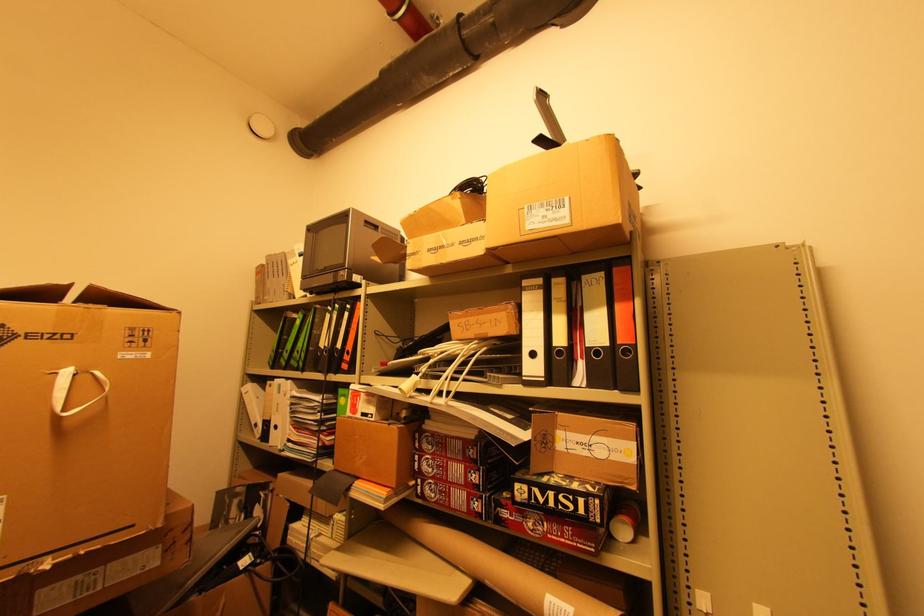
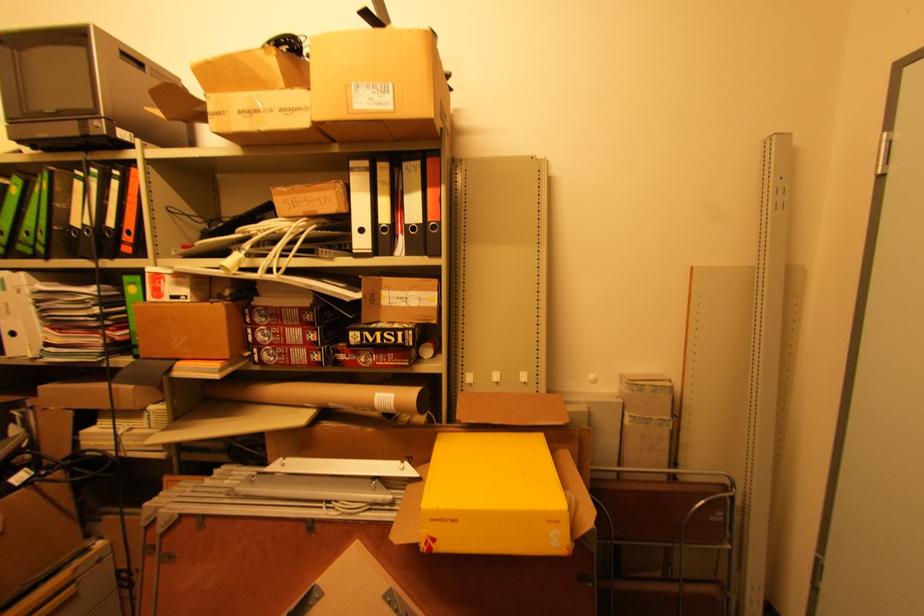
Locate, in the second image, the point that corresponds to point 553,446 in the first image.

(380, 302)